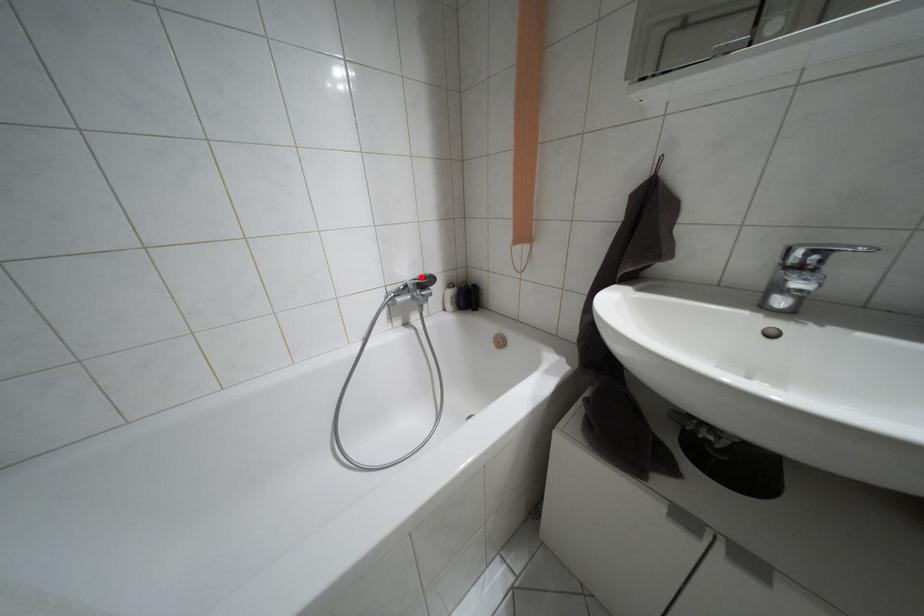
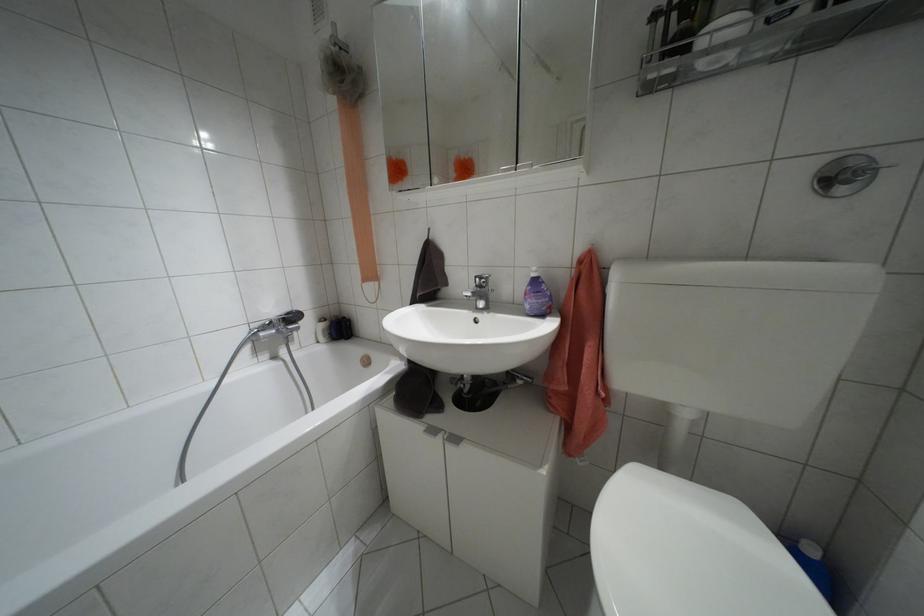
Where in the second image is the point corresponding to the highlighted location from the first image?

(286, 313)